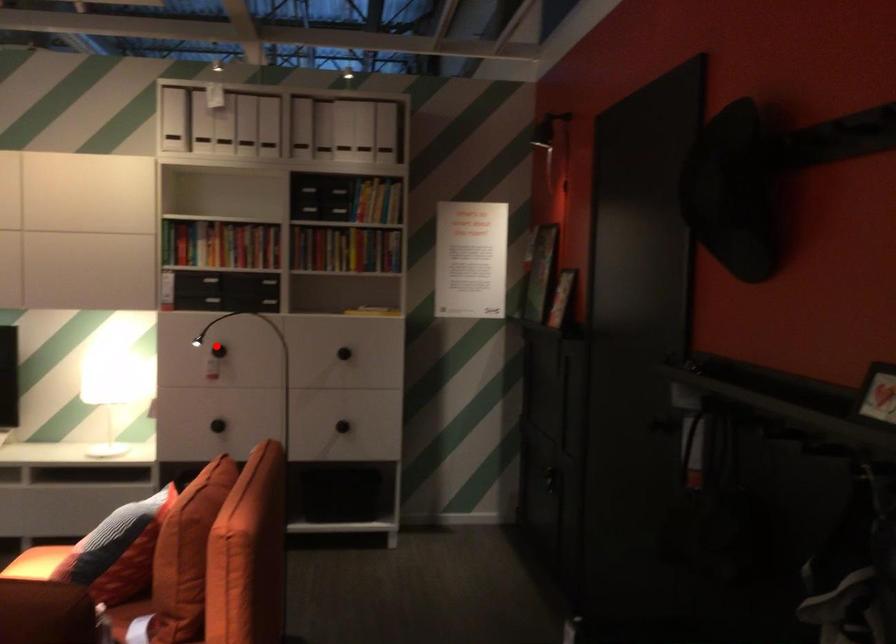
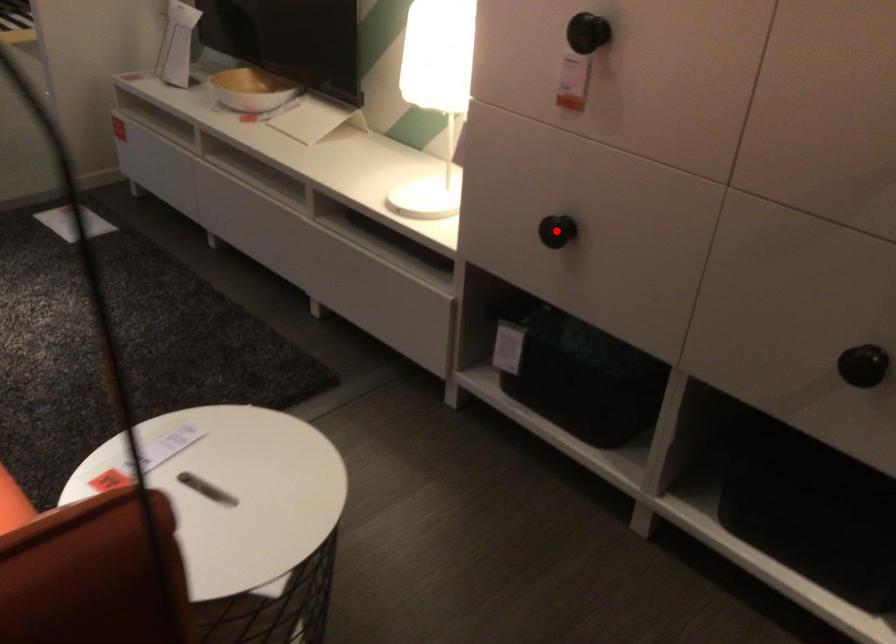
I am providing you with two images of the same scene from different viewpoints. A red point is marked on the first image and another point is marked on the second image. Does the point marked in image1 correspond to the same location as the one in image2?

No